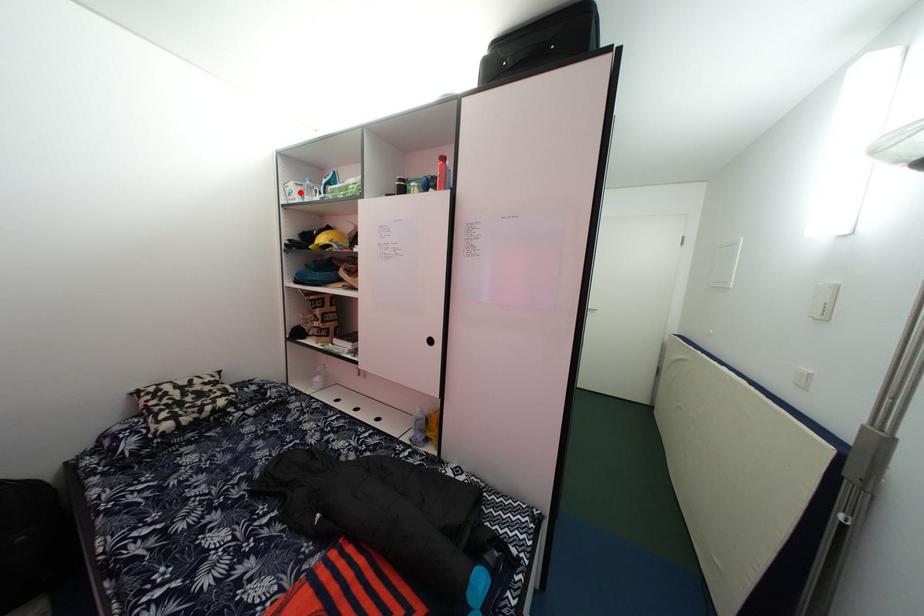
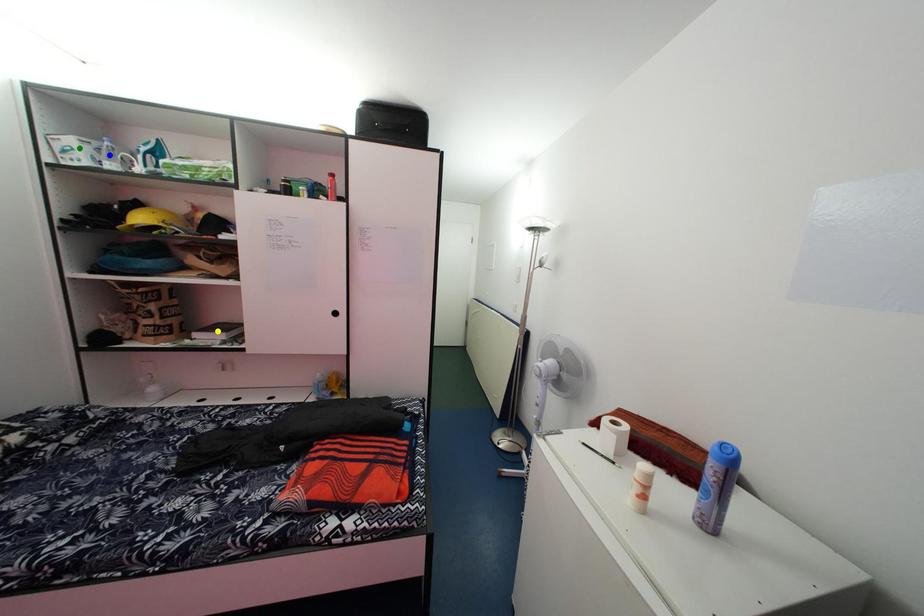
Question: I am providing you with two images of the same scene from different viewpoints. A red point is marked on the first image. You are given multiple points on the second image. Which mark in image 2 goes with the point in image 1?

Choices:
 (A) blue point
 (B) green point
 (C) yellow point

Answer: (B)